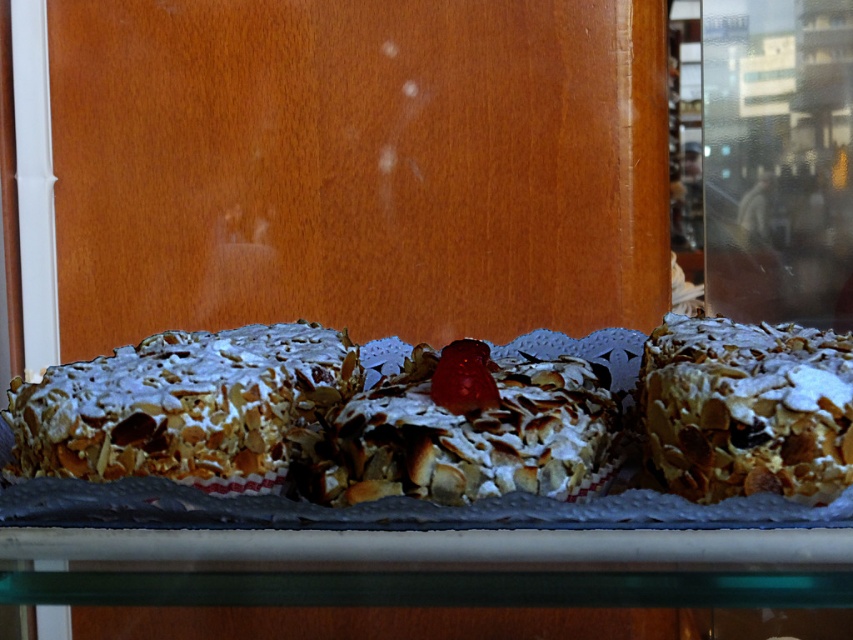
Is powdered almond cake at left positioned before powdery white almond cake at right?

No, it is behind powdery white almond cake at right.

Between powdered almond cake at left and powdery white almond cake at right, which one appears on the right side from the viewer's perspective?

powdery white almond cake at right

Is point (306, 349) less distant than point (807, 477)?

No, it is behind (807, 477).

Identify the location of powdered almond cake at left. (181, 404).

Does powdered almond cake at center appear over powdery white almond cake at right?

Correct, powdered almond cake at center is located above powdery white almond cake at right.

Is powdered almond cake at center wider than powdery white almond cake at right?

Correct, the width of powdered almond cake at center exceeds that of powdery white almond cake at right.

Is point (306, 458) less distant than point (668, 486)?

No, (306, 458) is behind (668, 486).

Locate an element on the screen. powdered almond cake at center is located at coordinates (465, 429).

Who is taller, powdered almond cake at left or powdered almond cake at center?

powdered almond cake at center is taller.

Does powdered almond cake at left come behind powdered almond cake at center?

Yes, it is behind powdered almond cake at center.

Who is more distant from viewer, (44,452) or (430,353)?

Point (430,353)

The image size is (853, 640). In order to click on powdered almond cake at left in this screenshot , I will do `click(181, 404)`.